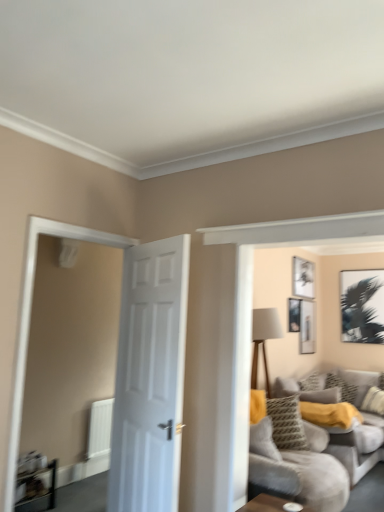
Question: Can you confirm if matte black picture frame at upper center, which is the fourth picture frame from right to left, is positioned to the right of patterned fabric pillow at center-right, arranged as the third pillow when viewed from the right?

Choices:
 (A) no
 (B) yes

Answer: (A)

Question: Would you consider matte black picture frame at upper center, which is the fourth picture frame from right to left, to be distant from patterned fabric pillow at center-right, which appears as the first pillow when viewed from the left?

Choices:
 (A) yes
 (B) no

Answer: (B)

Question: From the image's perspective, does matte black picture frame at upper center, marked as the first picture frame in a left-to-right arrangement, appear lower than patterned fabric pillow at center-right, which appears as the first pillow when viewed from the left?

Choices:
 (A) no
 (B) yes

Answer: (A)

Question: Considering the relative sizes of matte black picture frame at upper center, which is the fourth picture frame from right to left, and patterned fabric pillow at center-right, which appears as the first pillow when viewed from the left, in the image provided, is matte black picture frame at upper center, which is the fourth picture frame from right to left, bigger than patterned fabric pillow at center-right, which appears as the first pillow when viewed from the left,?

Choices:
 (A) yes
 (B) no

Answer: (B)

Question: Is matte black picture frame at upper center, marked as the first picture frame in a left-to-right arrangement, with patterned fabric pillow at center-right, arranged as the third pillow when viewed from the right?

Choices:
 (A) yes
 (B) no

Answer: (B)

Question: Is matte black picture frame at upper center, marked as the first picture frame in a left-to-right arrangement, outside of patterned fabric pillow at center-right, arranged as the third pillow when viewed from the right?

Choices:
 (A) no
 (B) yes

Answer: (B)

Question: Considering the relative sizes of patterned fabric pillow at center-right, arranged as the third pillow when viewed from the right, and matte black picture frame at upper center, marked as the first picture frame in a left-to-right arrangement, in the image provided, is patterned fabric pillow at center-right, arranged as the third pillow when viewed from the right, bigger than matte black picture frame at upper center, marked as the first picture frame in a left-to-right arrangement,?

Choices:
 (A) yes
 (B) no

Answer: (A)

Question: Is patterned fabric pillow at center-right, arranged as the third pillow when viewed from the right, positioned in front of matte black picture frame at upper center, marked as the first picture frame in a left-to-right arrangement?

Choices:
 (A) yes
 (B) no

Answer: (A)

Question: From the image's perspective, is patterned fabric pillow at center-right, arranged as the third pillow when viewed from the right, under matte black picture frame at upper center, which is the fourth picture frame from right to left?

Choices:
 (A) yes
 (B) no

Answer: (A)

Question: Is patterned fabric pillow at center-right, arranged as the third pillow when viewed from the right, completely or partially outside of matte black picture frame at upper center, which is the fourth picture frame from right to left?

Choices:
 (A) no
 (B) yes

Answer: (B)

Question: Is patterned fabric pillow at center-right, arranged as the third pillow when viewed from the right, further to camera compared to matte black picture frame at upper center, marked as the first picture frame in a left-to-right arrangement?

Choices:
 (A) yes
 (B) no

Answer: (B)

Question: From the image's perspective, is patterned fabric pillow at center-right, which appears as the first pillow when viewed from the left, above matte black picture frame at upper center, which is the fourth picture frame from right to left?

Choices:
 (A) no
 (B) yes

Answer: (A)

Question: Is black matte picture frame at upper right, the fourth picture frame in the left-to-right sequence, wider than yellow textured pillow at center, which ranks as the second pillow in right-to-left order?

Choices:
 (A) no
 (B) yes

Answer: (A)